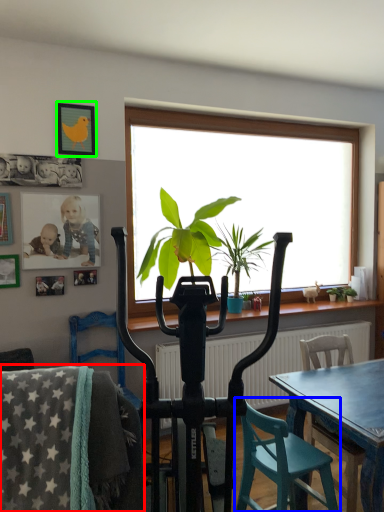
Question: Estimate the real-world distances between objects in this image. Which object is farther from chair (highlighted by a red box), chair (highlighted by a blue box) or picture frame (highlighted by a green box)?

Choices:
 (A) chair
 (B) picture frame

Answer: (B)